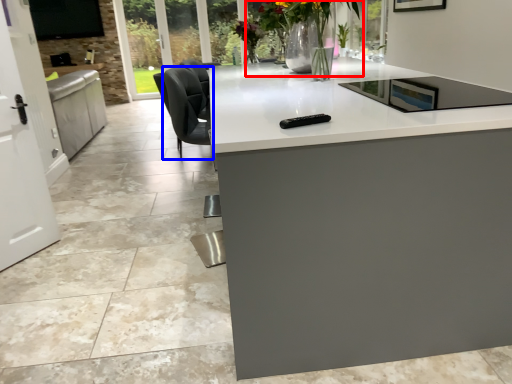
Question: Which object appears closest to the camera in this image, floral arrangement (highlighted by a red box) or swivel chair (highlighted by a blue box)?

Choices:
 (A) floral arrangement
 (B) swivel chair

Answer: (A)